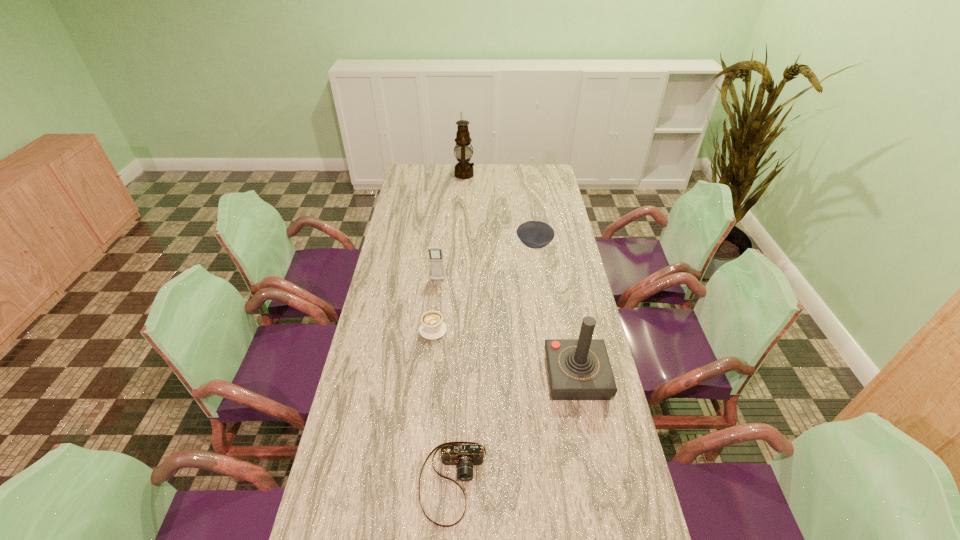
Where is `the farthest object`? the farthest object is located at coordinates (463, 169).

The height and width of the screenshot is (540, 960). I want to click on oil lamp, so click(x=463, y=169).

The image size is (960, 540). Identify the location of the second tallest object. (579, 369).

I want to click on joystick, so click(579, 369).

Identify the location of the third tallest object. (435, 253).

Identify the location of the third farthest object. The image size is (960, 540). (435, 253).

What are the coordinates of `the fifth nearest object` in the screenshot? It's located at (534, 234).

You are a GUI agent. You are given a task and a screenshot of the screen. Output one action in this format:
    pyautogui.click(x=<x>, y=<y>)
    Task: Click on the nearest object
    
    Given the screenshot: What is the action you would take?
    [x=464, y=457]

At what (x,y) coordinates should I click in order to perform the action: click on cappuccino. Please return your answer as a coordinate pair (x, y). This screenshot has height=540, width=960. Looking at the image, I should click on (432, 327).

Where is `vacant space situated on the left of the oil lamp`? This screenshot has width=960, height=540. vacant space situated on the left of the oil lamp is located at coordinates (432, 174).